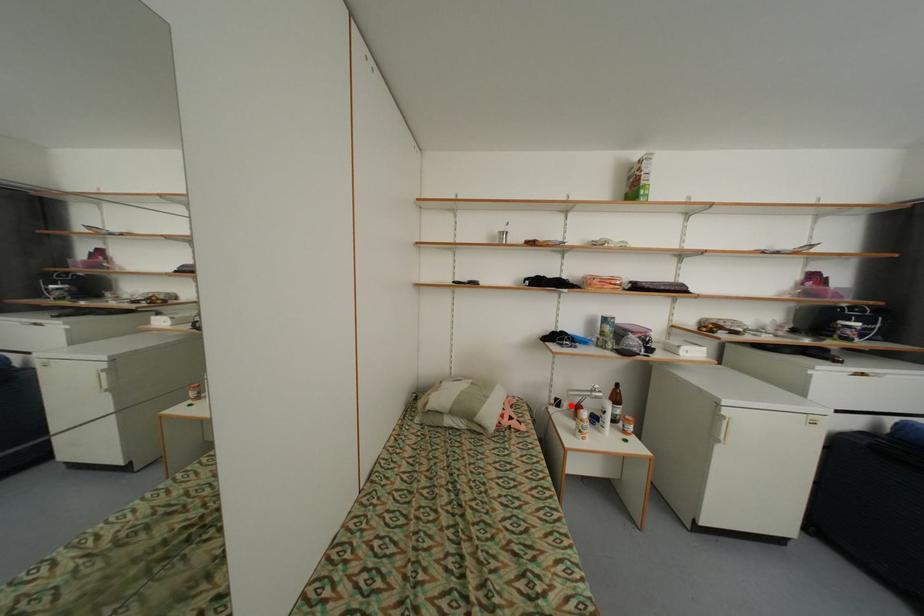
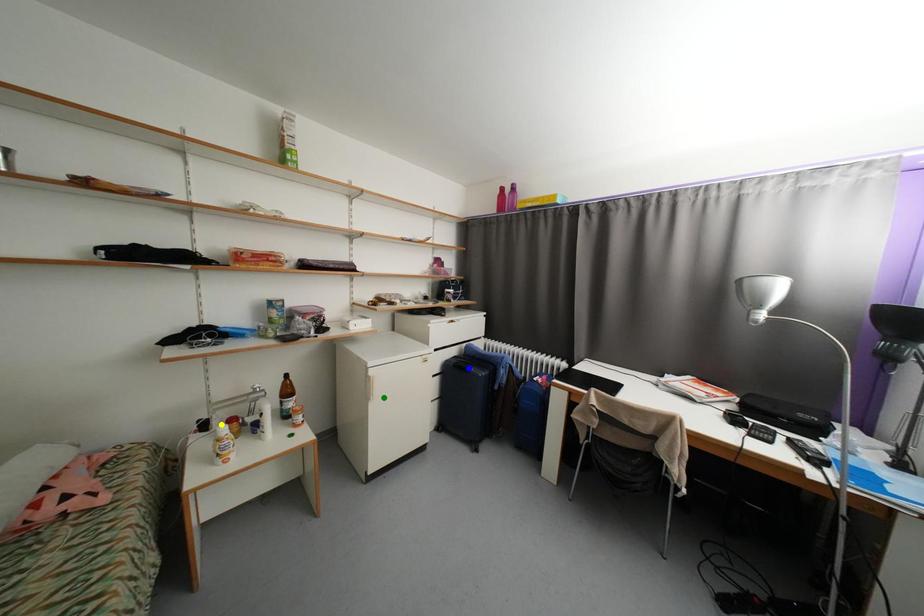
Question: I am providing you with two images of the same scene from different viewpoints. A red point is marked on the first image. You are given multiple points on the second image. Can you choose the point in image 2 that corresponds to the point in image 1?

Choices:
 (A) blue point
 (B) green point
 (C) yellow point

Answer: (C)